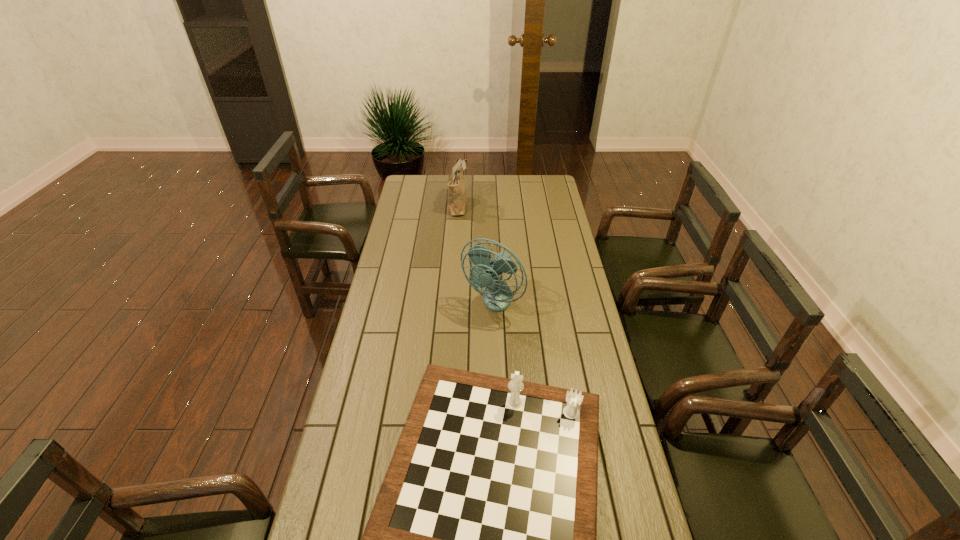
This screenshot has width=960, height=540. I want to click on free space at the far right corner of the desktop, so click(538, 191).

Select which object appears as the closest to the shoulder bag. Please provide its 2D coordinates. Your answer should be formatted as a tuple, i.e. [(x, y)], where the tuple contains the x and y coordinates of a point satisfying the conditions above.

[(497, 295)]

Locate which object ranks in proximity to the gameboard. Please provide its 2D coordinates. Your answer should be formatted as a tuple, i.e. [(x, y)], where the tuple contains the x and y coordinates of a point satisfying the conditions above.

[(497, 295)]